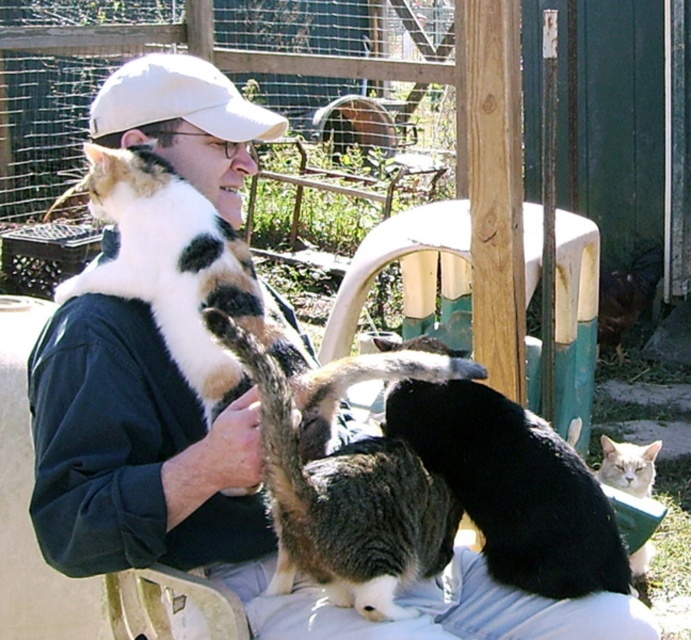
Question: Which object is the farthest from the white fabric cap at upper center?

Choices:
 (A) gray tabby cat at center
 (B) black fur cat at center

Answer: (B)

Question: Is gray tabby cat at center wider than white fabric cap at upper center?

Choices:
 (A) no
 (B) yes

Answer: (B)

Question: Is gray tabby cat at center bigger than white fabric cap at upper center?

Choices:
 (A) no
 (B) yes

Answer: (B)

Question: Which of the following is the farthest from the observer?

Choices:
 (A) (202, 83)
 (B) (477, 404)

Answer: (A)

Question: Which object is the farthest from the white fabric cap at upper center?

Choices:
 (A) black fur cat at center
 (B) gray tabby cat at center

Answer: (A)

Question: Does gray tabby cat at center lie in front of white fabric cap at upper center?

Choices:
 (A) no
 (B) yes

Answer: (B)